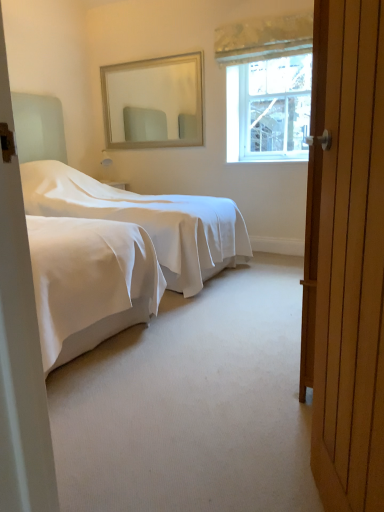
Find the location of a particular element. blank space situated above textured cream curtain at upper center (from a real-world perspective) is located at coordinates (276, 13).